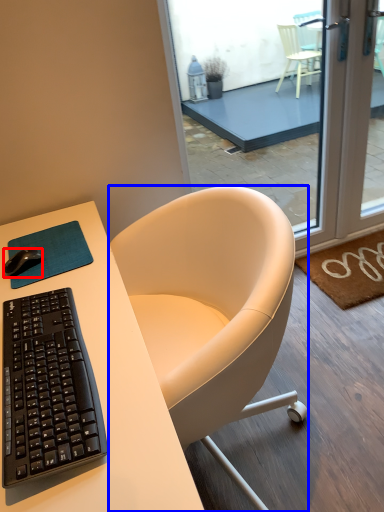
Question: Among these objects, which one is nearest to the camera, desk mouse (highlighted by a red box) or chair (highlighted by a blue box)?

Choices:
 (A) desk mouse
 (B) chair

Answer: (A)